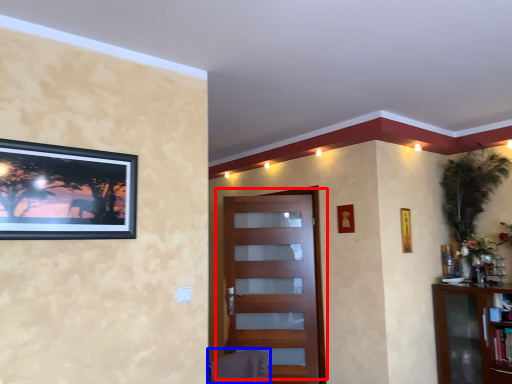
Question: Which of the following is the farthest to the observer, door (highlighted by a red box) or swivel chair (highlighted by a blue box)?

Choices:
 (A) door
 (B) swivel chair

Answer: (A)